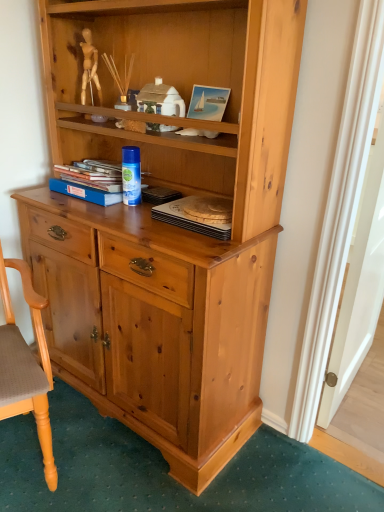
Question: Is the depth of wooden round tray at center, the second book positioned from the left, less than that of blue hardcover book at center, which is the 1th book in left-to-right order?

Choices:
 (A) yes
 (B) no

Answer: (A)

Question: Is wooden round tray at center, the 1th book viewed from the right, not within blue hardcover book at center, the 2th book positioned from the right?

Choices:
 (A) yes
 (B) no

Answer: (A)

Question: Is wooden round tray at center, the 1th book viewed from the right, facing away from blue hardcover book at center, which is the 1th book in left-to-right order?

Choices:
 (A) yes
 (B) no

Answer: (B)

Question: Considering the relative positions of wooden round tray at center, the 1th book viewed from the right, and blue hardcover book at center, the 2th book positioned from the right, in the image provided, is wooden round tray at center, the 1th book viewed from the right, behind blue hardcover book at center, the 2th book positioned from the right,?

Choices:
 (A) no
 (B) yes

Answer: (A)

Question: Could you tell me if wooden round tray at center, the second book positioned from the left, is facing blue hardcover book at center, the 2th book positioned from the right?

Choices:
 (A) yes
 (B) no

Answer: (B)

Question: Considering the relative positions of wooden round tray at center, the 1th book viewed from the right, and blue hardcover book at center, the 2th book positioned from the right, in the image provided, is wooden round tray at center, the 1th book viewed from the right, to the right of blue hardcover book at center, the 2th book positioned from the right, from the viewer's perspective?

Choices:
 (A) yes
 (B) no

Answer: (A)

Question: Considering the relative sizes of wooden polished chair at lower left and blue hardcover book at center, the 2th book positioned from the right, in the image provided, is wooden polished chair at lower left wider than blue hardcover book at center, the 2th book positioned from the right,?

Choices:
 (A) no
 (B) yes

Answer: (B)

Question: Can you confirm if wooden polished chair at lower left is positioned to the left of blue hardcover book at center, the 2th book positioned from the right?

Choices:
 (A) no
 (B) yes

Answer: (B)

Question: Considering the relative sizes of wooden polished chair at lower left and blue hardcover book at center, the 2th book positioned from the right, in the image provided, is wooden polished chair at lower left smaller than blue hardcover book at center, the 2th book positioned from the right,?

Choices:
 (A) yes
 (B) no

Answer: (B)

Question: Does wooden polished chair at lower left appear on the right side of blue hardcover book at center, the 2th book positioned from the right?

Choices:
 (A) yes
 (B) no

Answer: (B)

Question: Does wooden polished chair at lower left have a larger size compared to blue hardcover book at center, the 2th book positioned from the right?

Choices:
 (A) yes
 (B) no

Answer: (A)

Question: From a real-world perspective, does wooden polished chair at lower left sit lower than blue hardcover book at center, the 2th book positioned from the right?

Choices:
 (A) yes
 (B) no

Answer: (A)

Question: Can you confirm if blue hardcover book at center, the 2th book positioned from the right, is thinner than wooden polished chair at lower left?

Choices:
 (A) yes
 (B) no

Answer: (A)